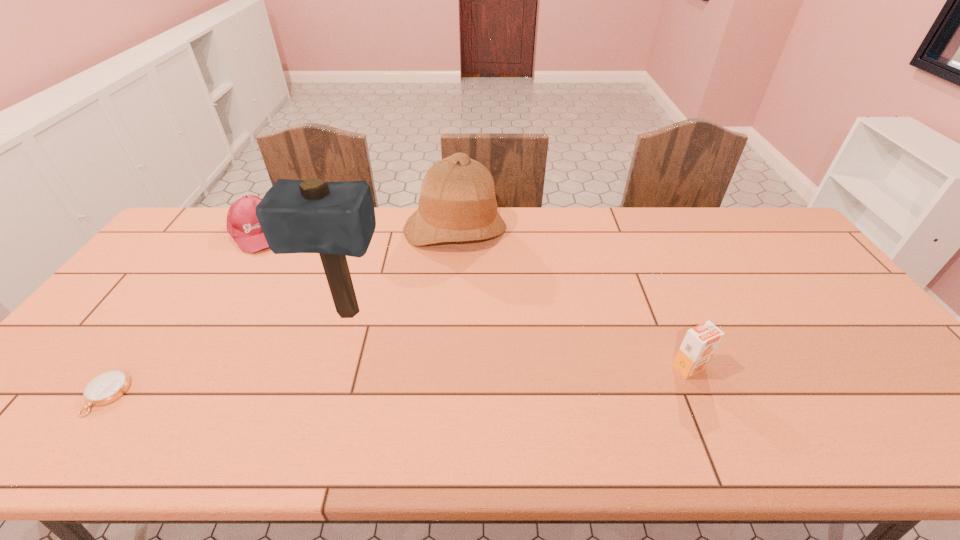
Locate an element on the screen. compass that is at the near edge is located at coordinates (109, 386).

This screenshot has height=540, width=960. What are the coordinates of `orange juice located at the near edge` in the screenshot? It's located at (700, 342).

This screenshot has height=540, width=960. In order to click on object situated at the left edge in this screenshot , I will do `click(109, 386)`.

The image size is (960, 540). I want to click on object located in the near left corner section of the desktop, so click(109, 386).

I want to click on free space at the far edge, so click(x=516, y=224).

What are the coordinates of `vacant space at the near edge of the desktop` in the screenshot? It's located at (460, 392).

In the image, there is a desktop. Where is `vacant space at the left edge`? vacant space at the left edge is located at coordinates (121, 354).

Image resolution: width=960 pixels, height=540 pixels. In order to click on vacant space at the right edge in this screenshot , I will do `click(810, 281)`.

Identify the location of vacant space at the far right corner of the desktop. (752, 242).

This screenshot has width=960, height=540. What are the coordinates of `vacant area between the third nearest object and the fourth tallest object` in the screenshot? It's located at (301, 273).